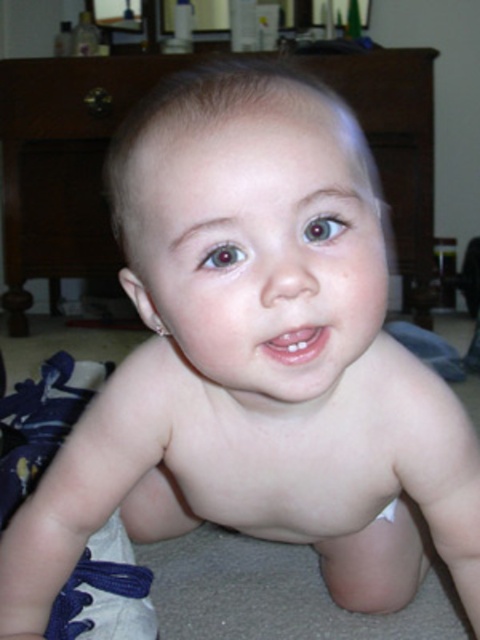
Question: Which point is closer to the camera?

Choices:
 (A) blue fabric shoe at lower left
 (B) brown wood dresser at upper center
 (C) white cloth diaper at lower center

Answer: (A)

Question: Which point is closer to the camera?

Choices:
 (A) pyautogui.click(x=382, y=515)
 (B) pyautogui.click(x=124, y=564)
 (C) pyautogui.click(x=430, y=301)

Answer: (B)

Question: Can you confirm if blue fabric shoe at lower left is smaller than white cloth diaper at lower center?

Choices:
 (A) no
 (B) yes

Answer: (A)

Question: Does blue fabric shoe at lower left have a greater width compared to white cloth diaper at lower center?

Choices:
 (A) no
 (B) yes

Answer: (B)

Question: Is brown wood dresser at upper center above white cloth diaper at lower center?

Choices:
 (A) no
 (B) yes

Answer: (B)

Question: Which object appears farthest from the camera in this image?

Choices:
 (A) white cloth diaper at lower center
 (B) blue fabric shoe at lower left
 (C) brown wood dresser at upper center

Answer: (C)